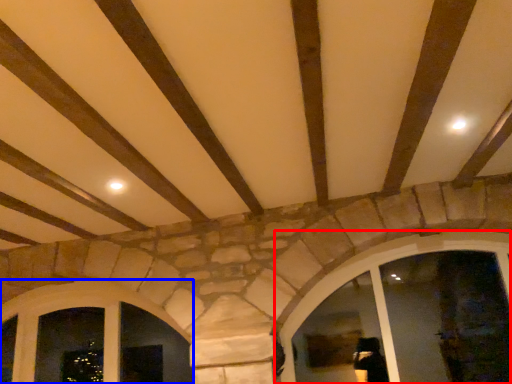
Question: Among these objects, which one is nearest to the camera, window (highlighted by a red box) or window (highlighted by a blue box)?

Choices:
 (A) window
 (B) window

Answer: (A)